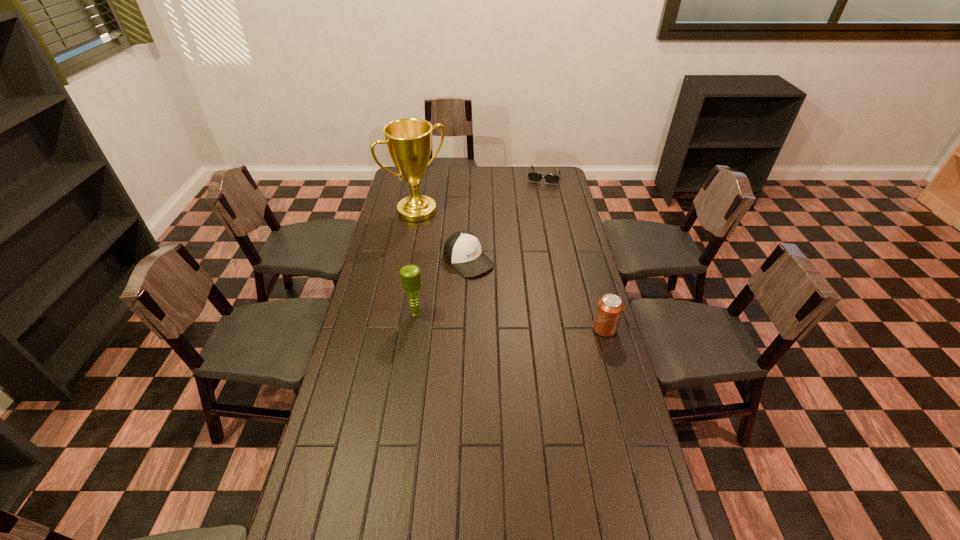
Find the location of a particular element. Image resolution: width=960 pixels, height=540 pixels. unoccupied area between the cap and the can is located at coordinates (537, 295).

Locate an element on the screen. The width and height of the screenshot is (960, 540). free space between the tallest object and the second shortest object is located at coordinates (443, 236).

What are the coordinates of `vacant space that is in between the third tallest object and the microphone` in the screenshot? It's located at (510, 321).

Find the location of a particular element. The height and width of the screenshot is (540, 960). blank region between the farthest object and the third object from right to left is located at coordinates (506, 219).

At what (x,y) coordinates should I click in order to perform the action: click on free area in between the cap and the microphone. Please return your answer as a coordinate pair (x, y). The height and width of the screenshot is (540, 960). Looking at the image, I should click on (443, 287).

Find the location of `vacant area that lies between the award and the shortest object`. vacant area that lies between the award and the shortest object is located at coordinates (480, 194).

Find the location of a particular element. Image resolution: width=960 pixels, height=540 pixels. unoccupied position between the cap and the microphone is located at coordinates (443, 287).

Locate which object ranks in proximity to the tallest object. Please provide its 2D coordinates. Your answer should be formatted as a tuple, i.e. [(x, y)], where the tuple contains the x and y coordinates of a point satisfying the conditions above.

[(462, 250)]

Where is `object that stands as the third closest to the microphone`? This screenshot has height=540, width=960. object that stands as the third closest to the microphone is located at coordinates (609, 309).

Locate an element on the screen. blank area in the image that satisfies the following two spatial constraints: 1. on the front side of the can; 2. on the left side of the sunglasses is located at coordinates (577, 329).